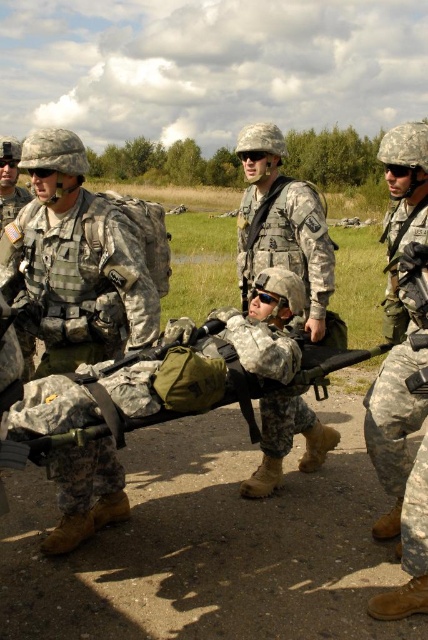
You are a photographer standing at the edge of the grassy field. You want to take a photo of the camouflage fabric uniform at center. Where should you aim your camera to capture it?

You should aim your camera at point (x=79, y=260) to capture the camouflage fabric uniform at center.